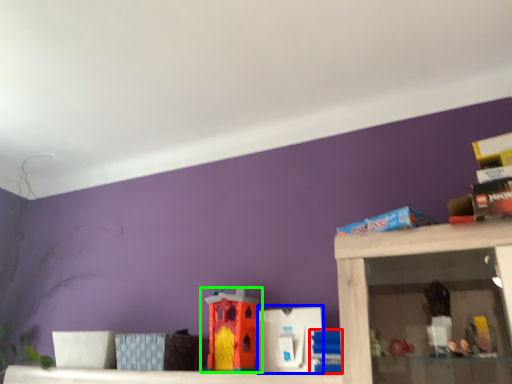
Question: Estimate the real-world distances between objects in this image. Which object is farther from toy (highlighted by a red box), toy (highlighted by a blue box) or toy (highlighted by a green box)?

Choices:
 (A) toy
 (B) toy

Answer: (B)